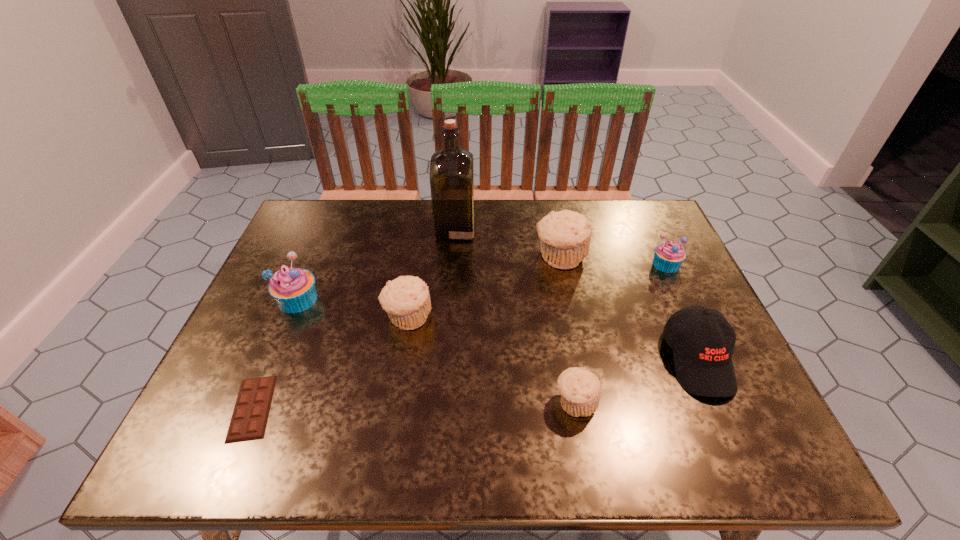
Locate an element on the screen. This screenshot has height=540, width=960. the nearest muffin is located at coordinates (580, 390).

Locate an element on the screen. The width and height of the screenshot is (960, 540). the smallest beige muffin is located at coordinates (580, 390).

Image resolution: width=960 pixels, height=540 pixels. In order to click on the shortest object in this screenshot , I will do `click(249, 419)`.

The height and width of the screenshot is (540, 960). Find the location of `vacant space located 0.250m on the label of the liquor`. vacant space located 0.250m on the label of the liquor is located at coordinates (556, 228).

The height and width of the screenshot is (540, 960). Identify the location of vacant space located 0.050m on the left of the farthest beige muffin. (516, 257).

At what (x,y) coordinates should I click in order to perform the action: click on vacant point located 0.150m on the front of the bigger blue muffin. Please return your answer as a coordinate pair (x, y). This screenshot has width=960, height=540. Looking at the image, I should click on (270, 366).

Find the location of a particular element. vacant space located on the front of the second farthest beige muffin is located at coordinates (400, 361).

Identify the location of vacant space situated 0.090m on the front-facing side of the black baseball cap. (735, 444).

Image resolution: width=960 pixels, height=540 pixels. In order to click on free location located 0.270m on the left of the rightmost muffin in this screenshot , I will do `click(554, 264)`.

Image resolution: width=960 pixels, height=540 pixels. I want to click on free location located 0.050m on the back of the smallest beige muffin, so click(569, 364).